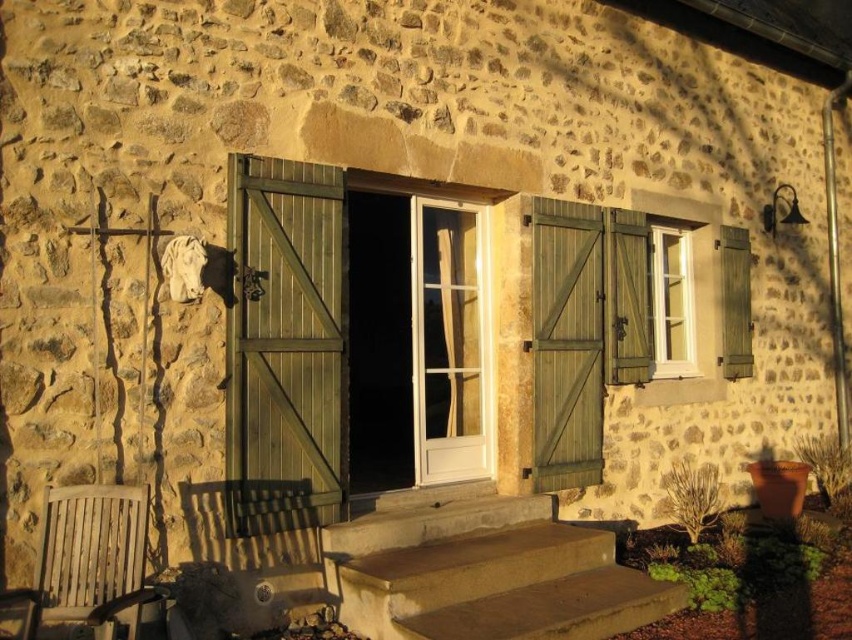
You are standing in front of the rustic stone house and want to sit down on the wooden slats chair at lower left. Which direction should you walk to reach it from the white plastic window at upper right?

The wooden slats chair at lower left is positioned on the left side of the white plastic window at upper right, so you should walk to the left to reach it.

You are a delivery person trying to deliver a package to the green wood door at center. You need to climb the smooth concrete steps at center to reach it. Can you step onto the steps without needing to jump?

The smooth concrete steps at center has a lesser height compared to green wood door at center, so yes, you can step onto the steps without needing to jump since the steps are lower in height than the door.